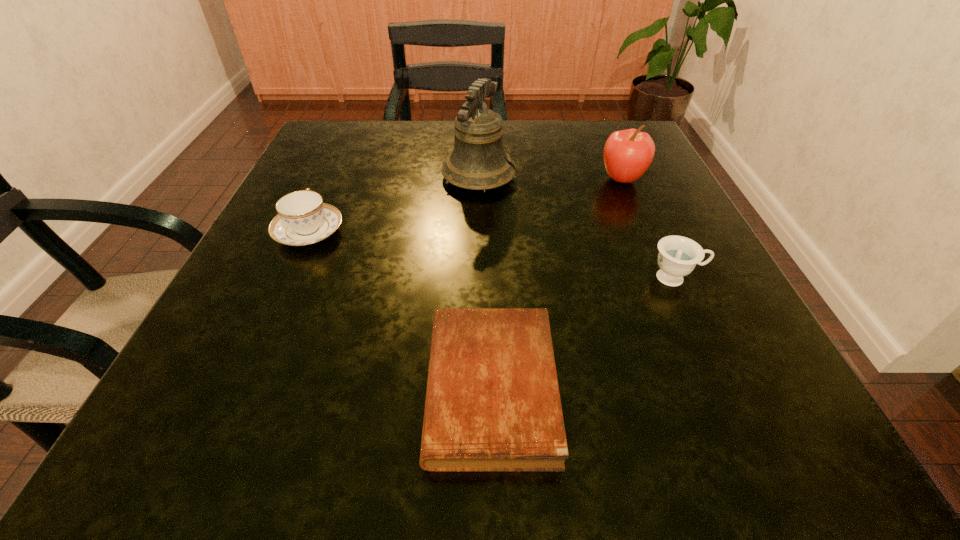
Locate an element on the screen. This screenshot has height=540, width=960. apple positioned at the right edge is located at coordinates (627, 155).

Where is `teacup that is at the right edge`? The width and height of the screenshot is (960, 540). teacup that is at the right edge is located at coordinates pyautogui.click(x=678, y=256).

Where is `object at the far right corner`? The image size is (960, 540). object at the far right corner is located at coordinates (627, 155).

You are a GUI agent. You are given a task and a screenshot of the screen. Output one action in this format:
    pyautogui.click(x=<x>, y=<y>)
    Task: Click on the vacant area at the far edge of the desktop
    This screenshot has height=540, width=960.
    Given the screenshot: What is the action you would take?
    pyautogui.click(x=565, y=154)

Image resolution: width=960 pixels, height=540 pixels. Identify the location of free region at the near edge of the desktop. (653, 415).

Image resolution: width=960 pixels, height=540 pixels. I want to click on vacant space at the left edge of the desktop, so click(x=221, y=334).

Identify the location of vacant space at the right edge. (638, 199).

Find the location of a particular element. vacant space at the far left corner of the desktop is located at coordinates pos(354,160).

This screenshot has height=540, width=960. Identify the location of vacant space at the far right corner. (579, 130).

In the image, there is a desktop. Where is `vacant space at the near right corner`? vacant space at the near right corner is located at coordinates (804, 451).